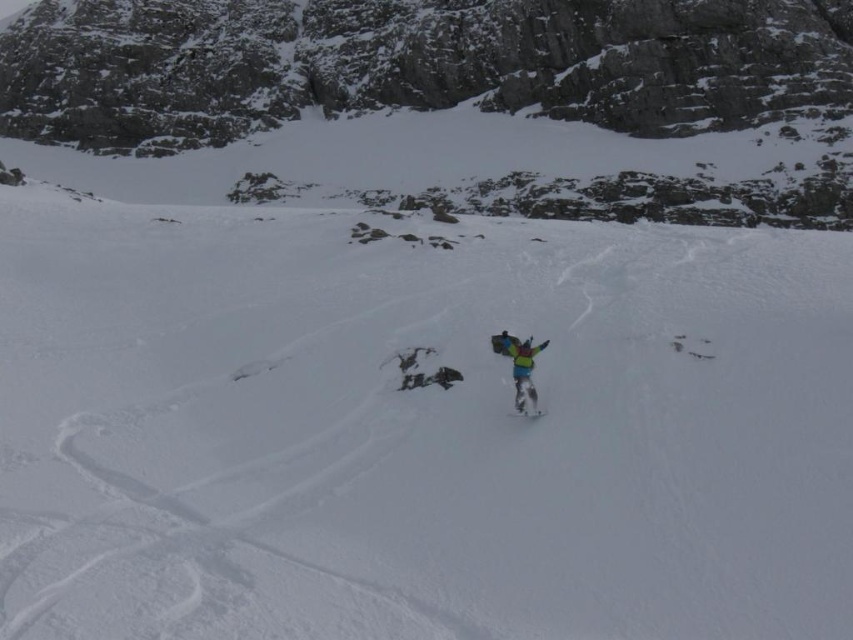
You are planning to build a small snowman in the snowy mountainous landscape. The snowman must be placed exactly at point (x=416, y=429). According to the image, what material will you primarily use for constructing the snowman?

The point (x=416, y=429) has white matte snow at center, so you can use white matte snow at center to build the snowman.

You are a photographer planning to take a picture of the multicolored fabric snowboarder at center and the white matte snow at center. Based on their positions, which object should you focus on first to ensure both are in frame?

The white matte snow at center is to the left of the multicolored fabric snowboarder at center, so you should focus on the multicolored fabric snowboarder at center first to ensure both are in frame.

You are standing at the base of the mountain and looking up at the snowy slope. There are two points marked on the slope. One is at coordinate point (106, 496) and the other is at point (709, 90). Which point is closer to you?

The point at coordinate point (106, 496) is closer to you than the point at (709, 90).